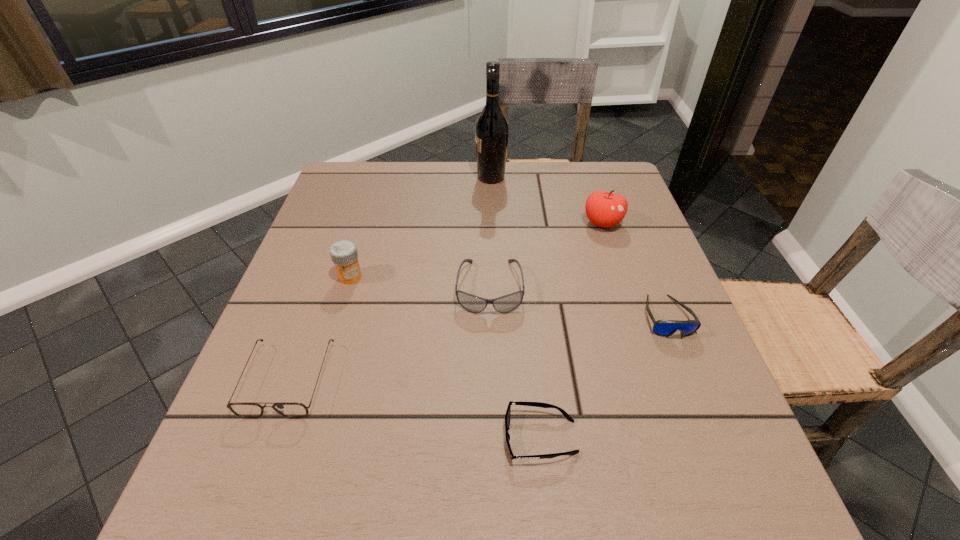
The height and width of the screenshot is (540, 960). Find the location of `wine bottle`. wine bottle is located at coordinates (491, 128).

This screenshot has height=540, width=960. In order to click on the tallest object in this screenshot , I will do `click(491, 128)`.

Identify the location of apple. (604, 209).

You are a GUI agent. You are given a task and a screenshot of the screen. Output one action in this format:
    pyautogui.click(x=<x>, y=<y>)
    Task: Click on the sixth nearest object
    
    Given the screenshot: What is the action you would take?
    point(604,209)

You are a GUI agent. You are given a task and a screenshot of the screen. Output one action in this format:
    pyautogui.click(x=<x>, y=<y>)
    Task: Click on the third tallest object
    
    Given the screenshot: What is the action you would take?
    pyautogui.click(x=344, y=254)

You are a GUI agent. You are given a task and a screenshot of the screen. Output one action in this format:
    pyautogui.click(x=<x>, y=<y>)
    Task: Click on the rightmost sunglasses
    This screenshot has height=540, width=960.
    Given the screenshot: What is the action you would take?
    pyautogui.click(x=665, y=328)

Where is `the leftmost sunglasses`? the leftmost sunglasses is located at coordinates (246, 410).

Where is `the shortest object`? The image size is (960, 540). the shortest object is located at coordinates (536, 404).

Where is `vacant region located 0.360m on the label of the tallest object`? The height and width of the screenshot is (540, 960). vacant region located 0.360m on the label of the tallest object is located at coordinates (349, 177).

Locate an element on the screen. vacant space located 0.140m on the label of the tallest object is located at coordinates (426, 177).